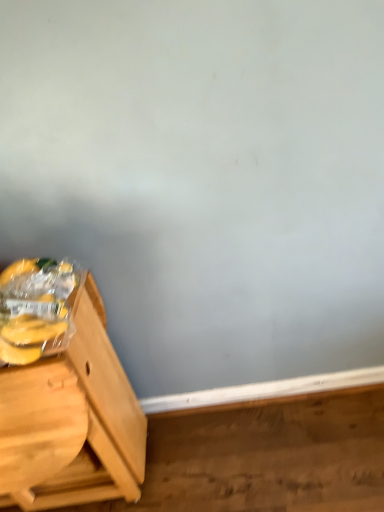
Question: Is yellow matte plastic bananas at left taller or shorter than light brown wood table at left?

Choices:
 (A) short
 (B) tall

Answer: (A)

Question: From a real-world perspective, is yellow matte plastic bananas at left physically located above or below light brown wood table at left?

Choices:
 (A) below
 (B) above

Answer: (B)

Question: Is yellow matte plastic bananas at left situated inside light brown wood table at left or outside?

Choices:
 (A) outside
 (B) inside

Answer: (A)

Question: Is light brown wood table at left bigger or smaller than yellow matte plastic bananas at left?

Choices:
 (A) big
 (B) small

Answer: (A)

Question: From the image's perspective, is light brown wood table at left positioned above or below yellow matte plastic bananas at left?

Choices:
 (A) below
 (B) above

Answer: (A)

Question: Looking at their shapes, would you say light brown wood table at left is wider or thinner than yellow matte plastic bananas at left?

Choices:
 (A) wide
 (B) thin

Answer: (A)

Question: Does point (18, 419) appear closer or farther from the camera than point (3, 326)?

Choices:
 (A) closer
 (B) farther

Answer: (B)